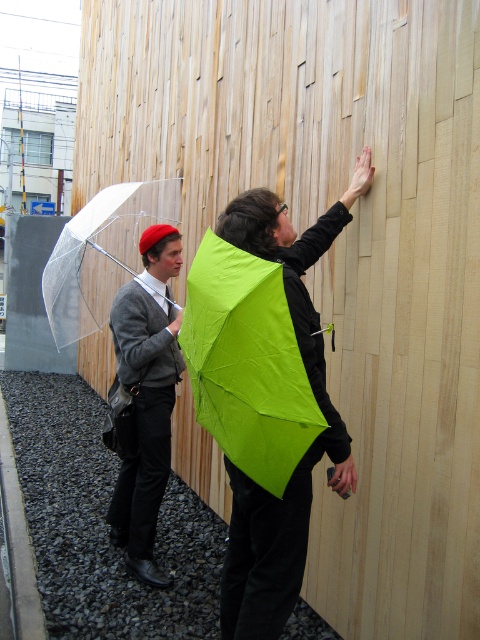
You are a photographer trying to capture a closeup of the matte gray sweater at center without the transparent plastic umbrella at left obstructing the view. Is this possible based on their positions?

The matte gray sweater at center is closer to the viewer than the transparent plastic umbrella at left, so the sweater would block the view of the umbrella, making it possible to capture a closeup of the sweater without obstruction.

Looking at this image, you are a tailor measuring two items in the image. The first item is the matte gray sweater at center, and the second is the transparent plastic umbrella at left. Which item has a smaller width?

The matte gray sweater at center has a smaller width than the transparent plastic umbrella at left according to the description.

You are a photographer trying to capture both the matte green umbrella at center and the transparent plastic umbrella at left in a single frame. Based on their positions, which umbrella is closer to the camera?

The matte green umbrella at center is located below the transparent plastic umbrella at left, so the transparent plastic umbrella at left is closer to the camera.